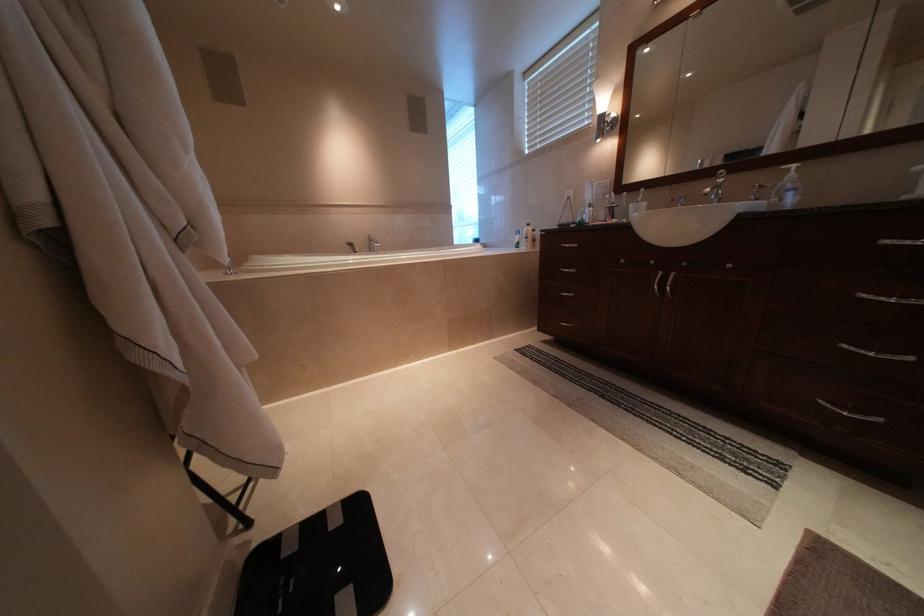
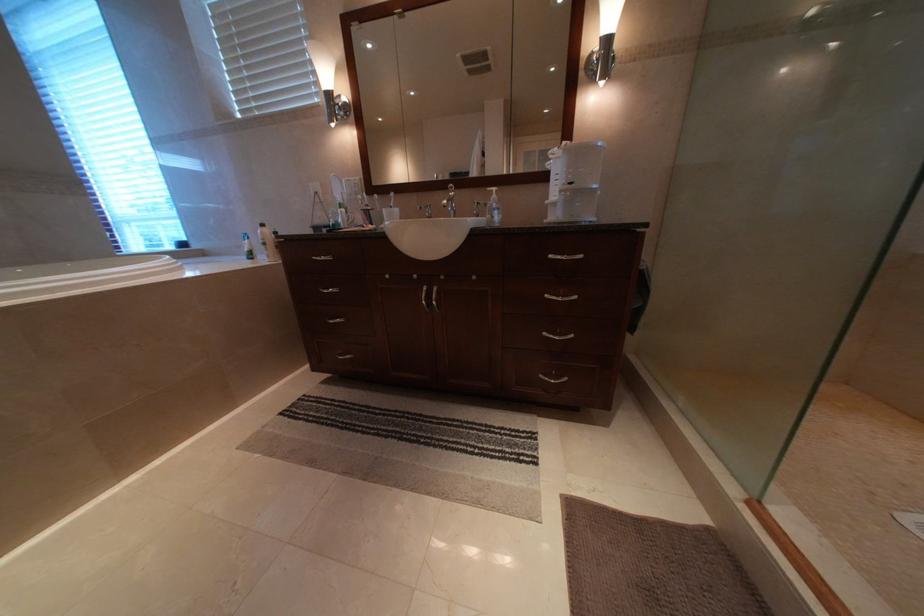
Question: The images are taken continuously from a first-person perspective. In which direction is your viewpoint rotating?

Choices:
 (A) Left
 (B) Right
 (C) Up
 (D) Down

Answer: (B)